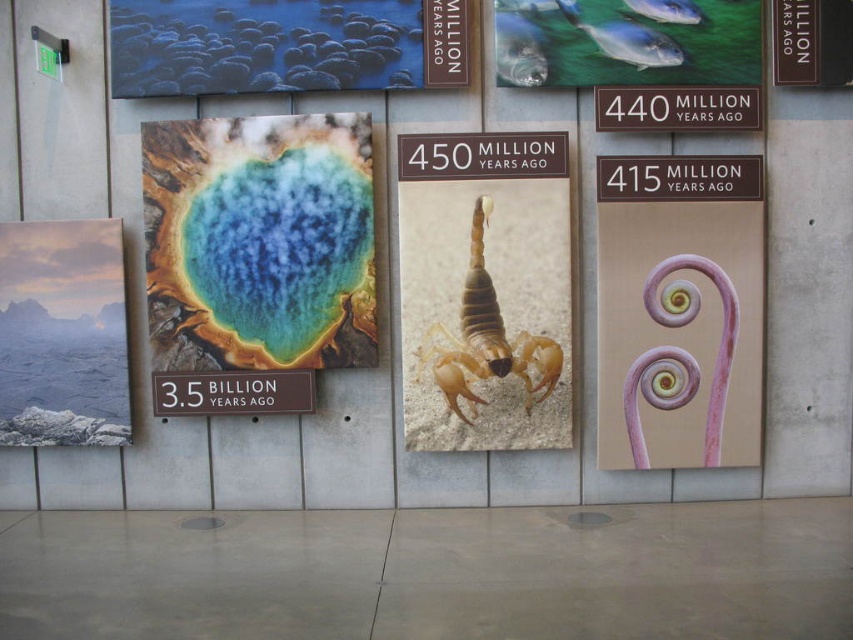
Can you confirm if black plastic sign at upper center is taller than brown/metallic sign at center?

No, black plastic sign at upper center is not taller than brown/metallic sign at center.

Is black plastic sign at upper center shorter than brown/metallic sign at center?

Yes.

This screenshot has height=640, width=853. Describe the element at coordinates (677, 108) in the screenshot. I see `black plastic sign at upper center` at that location.

Find the location of a particular element. The width and height of the screenshot is (853, 640). black plastic sign at upper center is located at coordinates (677, 108).

Based on the photo, can you confirm if shiny silver fish at upper center is shorter than brown/metallic sign at center?

In fact, shiny silver fish at upper center may be taller than brown/metallic sign at center.

Is shiny silver fish at upper center below brown/metallic sign at center?

No, shiny silver fish at upper center is not below brown/metallic sign at center.

Is point (633, 19) closer to viewer compared to point (282, 394)?

Yes, it is.

Image resolution: width=853 pixels, height=640 pixels. I want to click on shiny silver fish at upper center, so click(x=627, y=42).

Can you confirm if rustic stone landscape at left is positioned above translucent beige scorpion at center?

Actually, rustic stone landscape at left is below translucent beige scorpion at center.

Which is below, rustic stone landscape at left or translucent beige scorpion at center?

rustic stone landscape at left

Identify the location of rustic stone landscape at left. The image size is (853, 640). (62, 333).